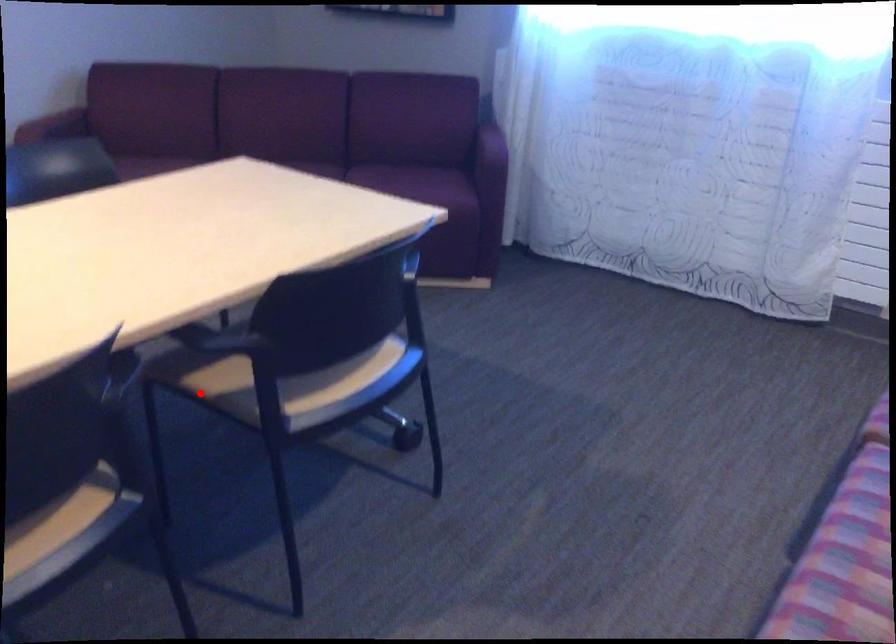
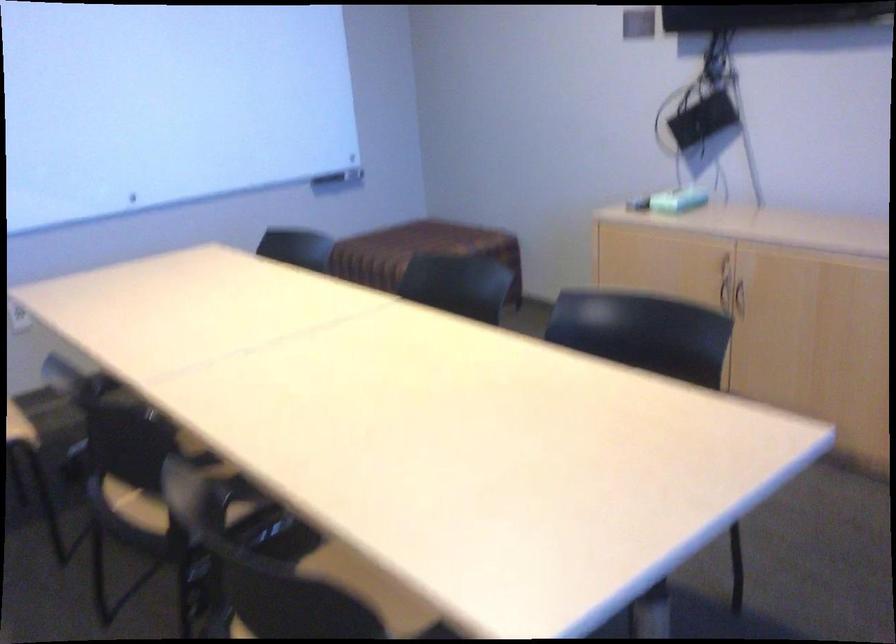
In the second image, find the point that corresponds to the highlighted location in the first image.

(337, 569)